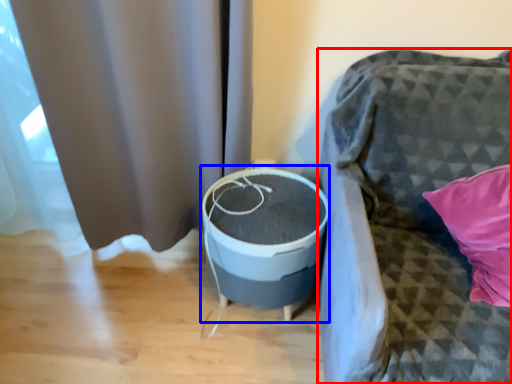
Question: Among these objects, which one is nearest to the camera, furniture (highlighted by a red box) or round table (highlighted by a blue box)?

Choices:
 (A) furniture
 (B) round table

Answer: (A)